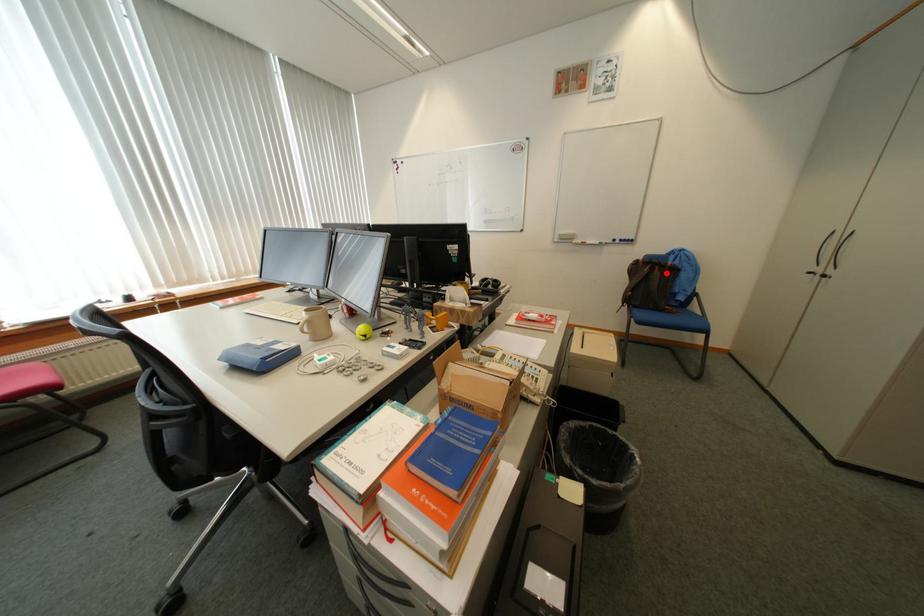
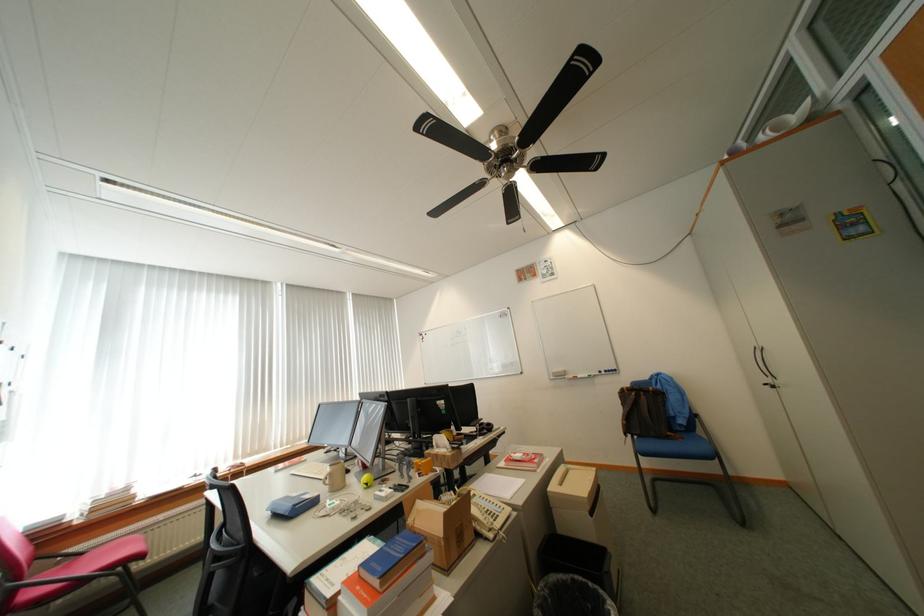
The point at the highlighted location is marked in the first image. Where is the corresponding point in the second image?

(652, 399)